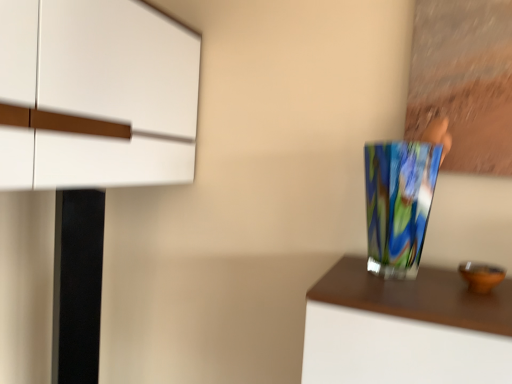
Question: Considering the relative sizes of white matte cabinet at upper left and multicolored glass vase at right in the image provided, is white matte cabinet at upper left wider than multicolored glass vase at right?

Choices:
 (A) yes
 (B) no

Answer: (A)

Question: Is multicolored glass vase at right a part of white matte cabinet at upper left?

Choices:
 (A) yes
 (B) no

Answer: (B)

Question: From a real-world perspective, is white matte cabinet at upper left physically above multicolored glass vase at right?

Choices:
 (A) yes
 (B) no

Answer: (A)

Question: Can you confirm if white matte cabinet at upper left is positioned to the right of multicolored glass vase at right?

Choices:
 (A) yes
 (B) no

Answer: (B)

Question: Can you confirm if white matte cabinet at upper left is thinner than multicolored glass vase at right?

Choices:
 (A) no
 (B) yes

Answer: (A)

Question: Would you say white matte cabinet at upper left is outside multicolored glass vase at right?

Choices:
 (A) no
 (B) yes

Answer: (B)

Question: Is multicolored glass vase at right bigger than white matte cabinet at upper left?

Choices:
 (A) yes
 (B) no

Answer: (B)

Question: Is white matte cabinet at upper left completely or partially inside multicolored glass vase at right?

Choices:
 (A) no
 (B) yes

Answer: (A)

Question: Is multicolored glass vase at right taller than white matte cabinet at upper left?

Choices:
 (A) no
 (B) yes

Answer: (A)

Question: Is multicolored glass vase at right not inside white matte cabinet at upper left?

Choices:
 (A) no
 (B) yes

Answer: (B)

Question: Could you tell me if multicolored glass vase at right is facing white matte cabinet at upper left?

Choices:
 (A) no
 (B) yes

Answer: (A)

Question: Can you confirm if multicolored glass vase at right is thinner than white matte cabinet at upper left?

Choices:
 (A) no
 (B) yes

Answer: (B)

Question: From a real-world perspective, is multicolored glass vase at right positioned above or below white matte cabinet at upper left?

Choices:
 (A) above
 (B) below

Answer: (B)